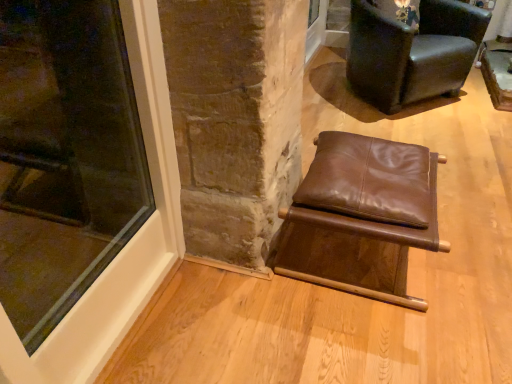
This screenshot has height=384, width=512. I want to click on free location in front of dark brown leather chair at upper right, the second chair when ordered from bottom to top, so click(443, 138).